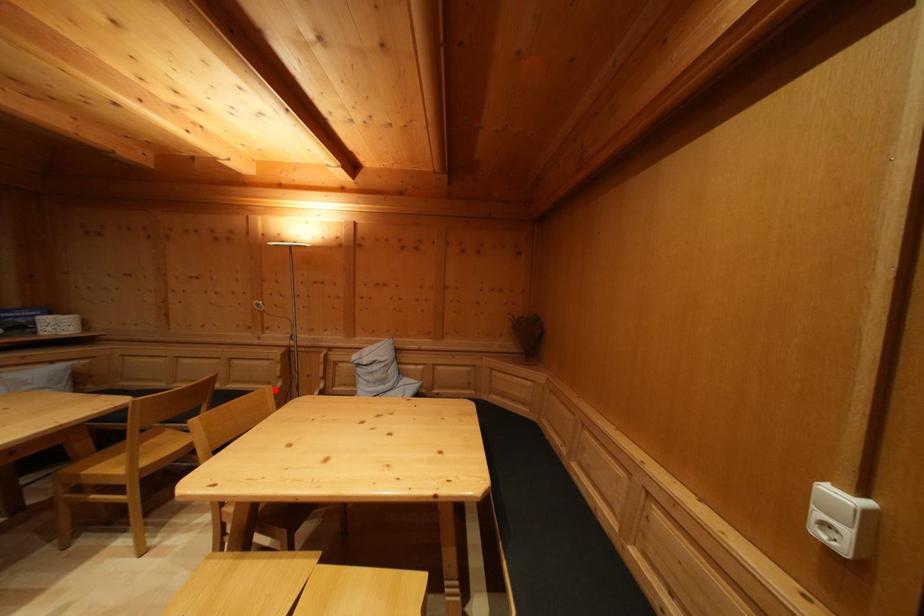
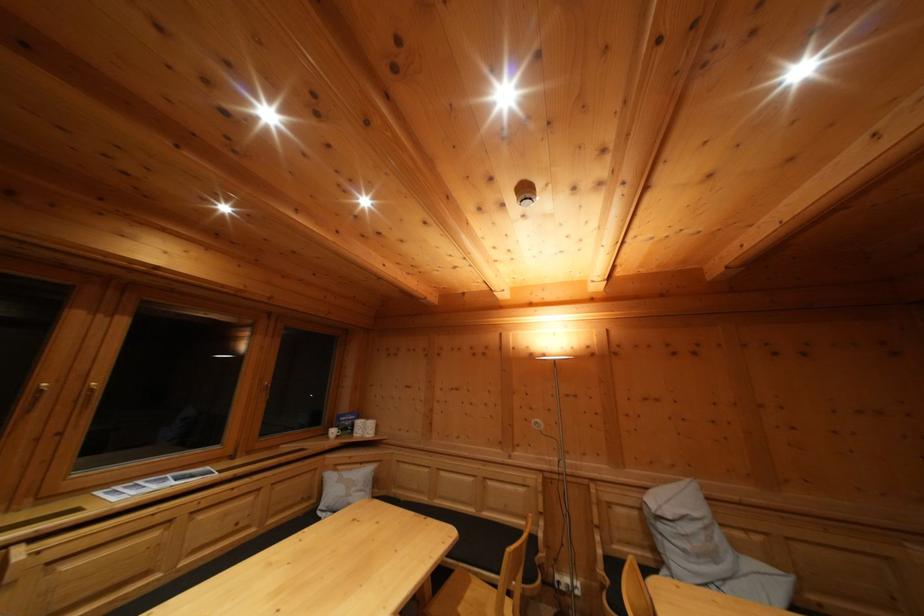
In the second image, find the point that corresponds to the highlighted location in the first image.

(532, 525)